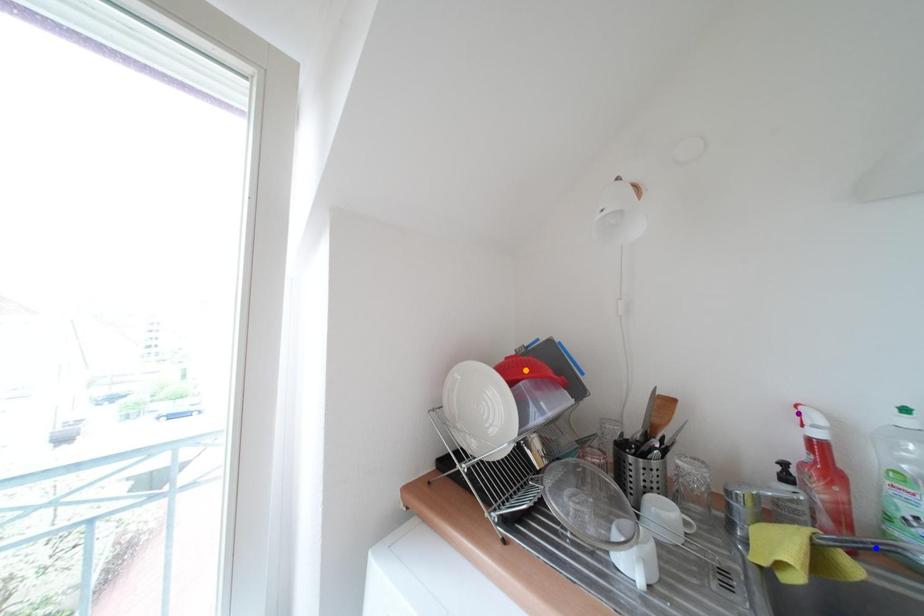
Order these from nearest to farthest:
purple point
orange point
blue point

blue point, purple point, orange point